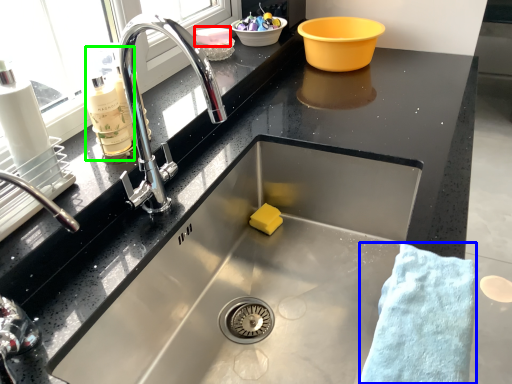
Question: Which object is the farthest from food (highlighted by a red box)? Choose among these: bath towel (highlighted by a blue box) or cleaning product (highlighted by a green box).

Choices:
 (A) bath towel
 (B) cleaning product

Answer: (A)